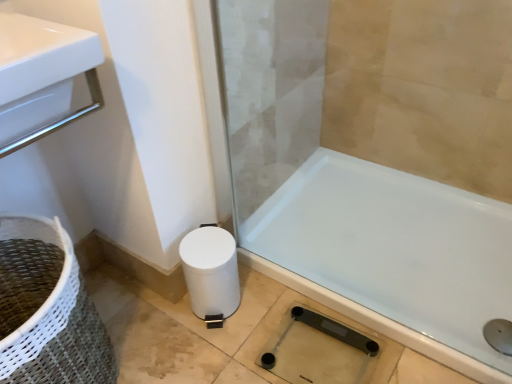
Question: From a real-world perspective, is transparent glass screen door at lower center positioned above or below white matte toilet paper at lower left?

Choices:
 (A) above
 (B) below

Answer: (A)

Question: Relative to white matte toilet paper at lower left, is transparent glass screen door at lower center in front or behind?

Choices:
 (A) behind
 (B) front

Answer: (B)

Question: Considering the real-world distances, which object is farthest from the transparent glass screen door at lower center?

Choices:
 (A) transparent glass shower at lower right
 (B) white woven basket at lower left
 (C) white glossy bathtub at lower right
 (D) white matte toilet paper at lower left

Answer: (B)

Question: Estimate the real-world distances between objects in this image. Which object is farther from the white woven basket at lower left?

Choices:
 (A) white glossy bathtub at lower right
 (B) transparent glass screen door at lower center
 (C) transparent glass shower at lower right
 (D) white matte toilet paper at lower left

Answer: (A)